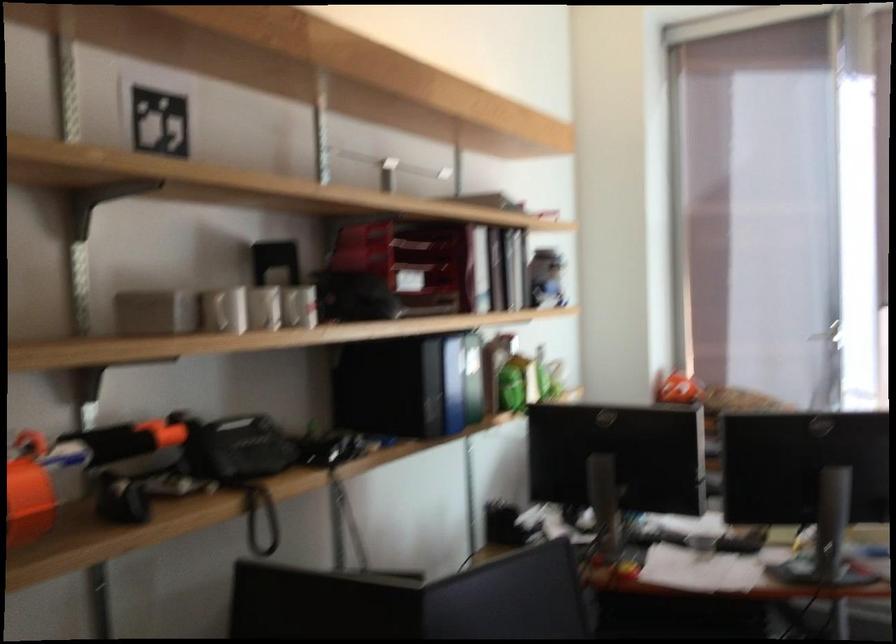
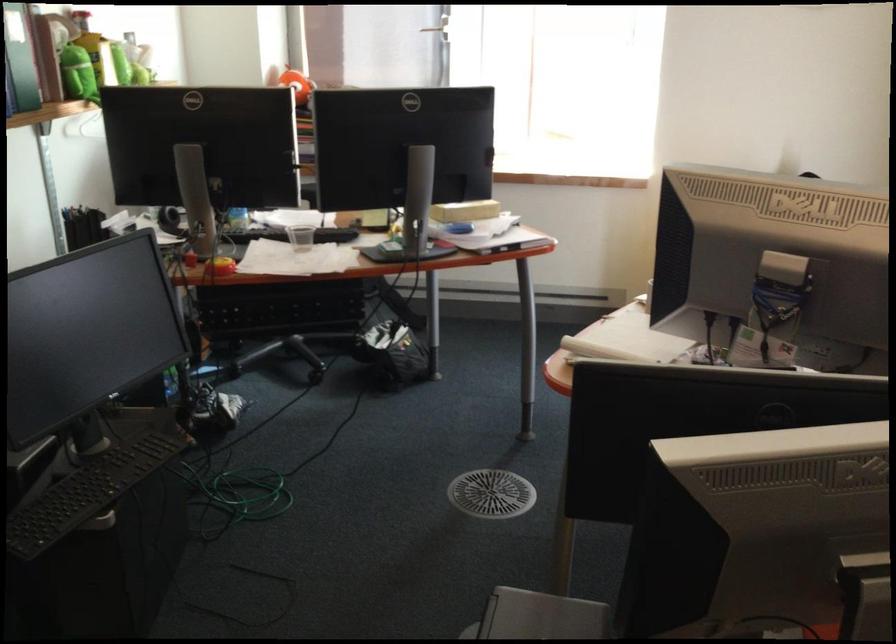
Where in the second image is the point corresponding to point 513,389 from the first image?

(78, 73)